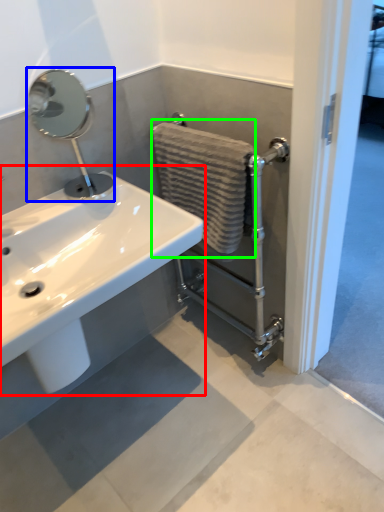
Question: Which is nearer to the sink (highlighted by a red box)? plumbing fixture (highlighted by a blue box) or bath towel (highlighted by a green box).

Choices:
 (A) plumbing fixture
 (B) bath towel

Answer: (B)